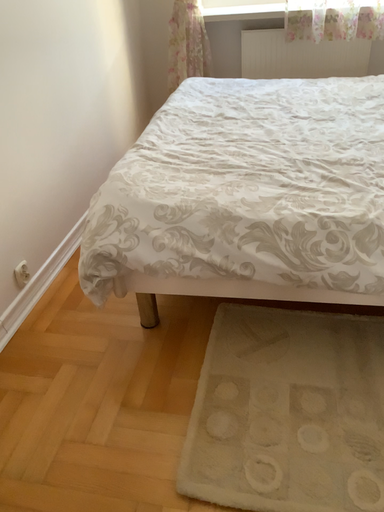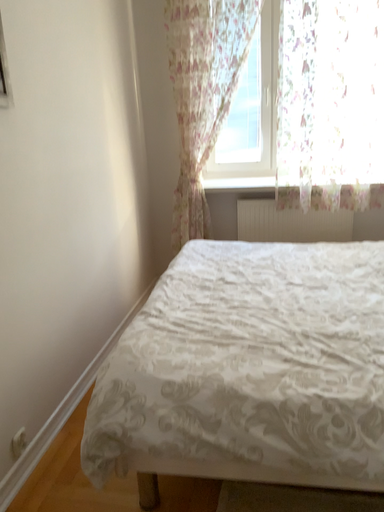
Question: How did the camera likely rotate when shooting the video?

Choices:
 (A) rotated downward
 (B) rotated upward

Answer: (B)